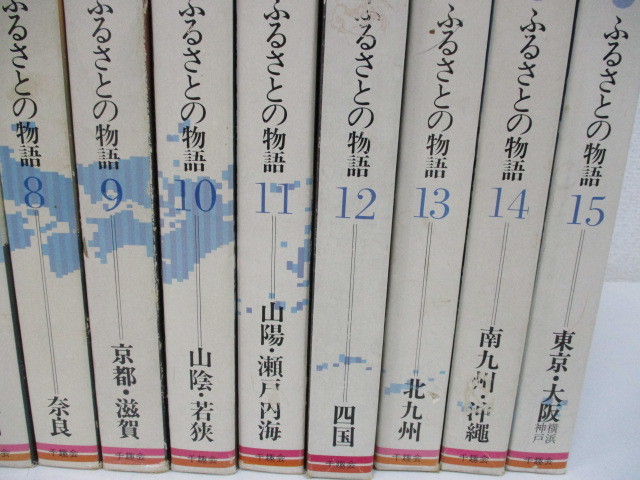
Find the location of `book 12`. book 12 is located at coordinates (349, 228).